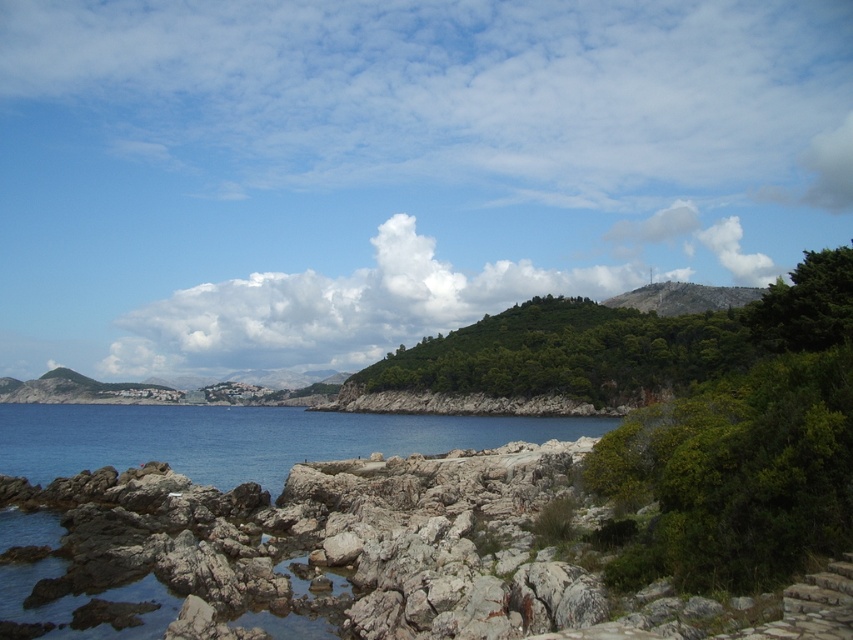
What do you see at coordinates (334, 308) in the screenshot? I see `white fluffy cloud at upper center` at bounding box center [334, 308].

Between white fluffy cloud at upper center and green leafy hill at center, which one is positioned higher?

white fluffy cloud at upper center is above.

Image resolution: width=853 pixels, height=640 pixels. Find the location of `white fluffy cloud at upper center`. white fluffy cloud at upper center is located at coordinates (334, 308).

Locate an element on the screen. The width and height of the screenshot is (853, 640). white fluffy cloud at upper center is located at coordinates (334, 308).

Is green leafy hill at center to the right of blue water at lower left from the viewer's perspective?

Indeed, green leafy hill at center is positioned on the right side of blue water at lower left.

Between point (650, 397) and point (107, 429), which one is positioned behind?

The point (650, 397) is more distant.

Does point (722, 296) come farther from viewer compared to point (117, 406)?

No, (722, 296) is closer to viewer.

The width and height of the screenshot is (853, 640). What are the coordinates of `green leafy hill at center` in the screenshot? It's located at (561, 356).

Who is shorter, white fluffy cloud at upper center or blue water at lower left?

blue water at lower left

What do you see at coordinates (334, 308) in the screenshot? I see `white fluffy cloud at upper center` at bounding box center [334, 308].

Locate an element on the screen. This screenshot has width=853, height=640. white fluffy cloud at upper center is located at coordinates (334, 308).